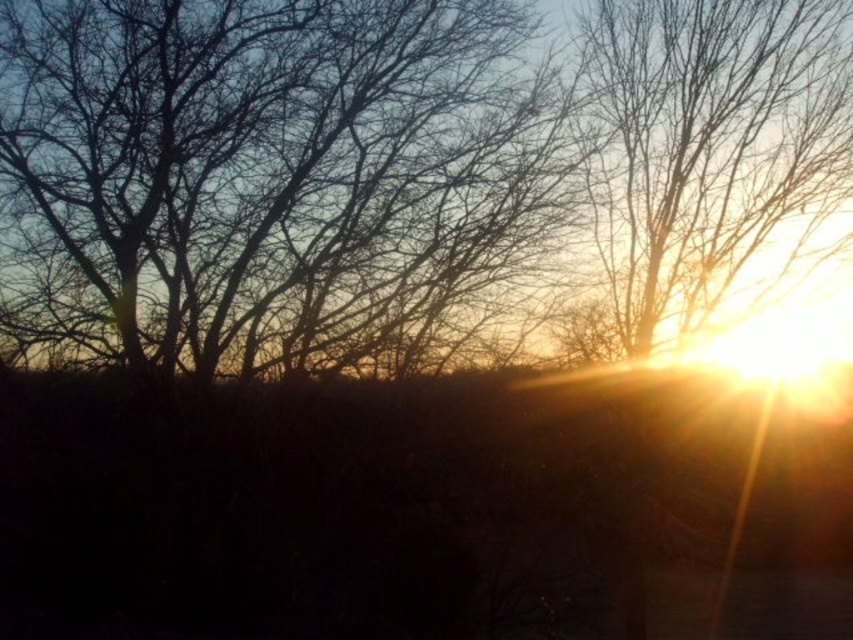
Question: Which object appears closest to the camera in this image?

Choices:
 (A) translucent golden sun at upper right
 (B) brown/dry wood tree at upper left

Answer: (B)

Question: Does brown/dry wood tree at upper left have a lesser width compared to translucent golden sun at upper right?

Choices:
 (A) no
 (B) yes

Answer: (A)

Question: Which point is farther to the camera?

Choices:
 (A) translucent golden sun at upper right
 (B) brown/dry wood tree at upper left

Answer: (A)

Question: Can you confirm if brown/dry wood tree at upper left is positioned below translucent golden sun at upper right?

Choices:
 (A) yes
 (B) no

Answer: (A)

Question: Is brown/dry wood tree at upper left smaller than translucent golden sun at upper right?

Choices:
 (A) no
 (B) yes

Answer: (A)

Question: Which of the following is the farthest from the observer?

Choices:
 (A) brown/dry wood tree at upper left
 (B) translucent golden sun at upper right

Answer: (B)